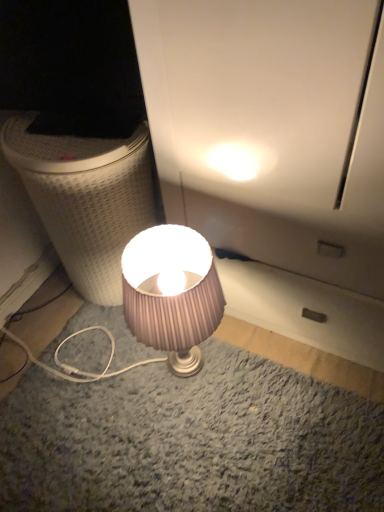
Find the location of a particular element. pink pleated fabric lampshade at center is located at coordinates (161, 301).

The height and width of the screenshot is (512, 384). What do you see at coordinates (161, 301) in the screenshot?
I see `pink pleated fabric lampshade at center` at bounding box center [161, 301].

Where is `pink pleated fabric lampshade at center`? pink pleated fabric lampshade at center is located at coordinates (161, 301).